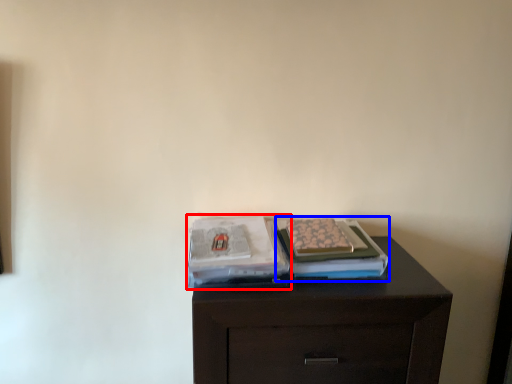
Question: Which object is further to the camera taking this photo, magazine (highlighted by a red box) or magazine (highlighted by a blue box)?

Choices:
 (A) magazine
 (B) magazine

Answer: (B)